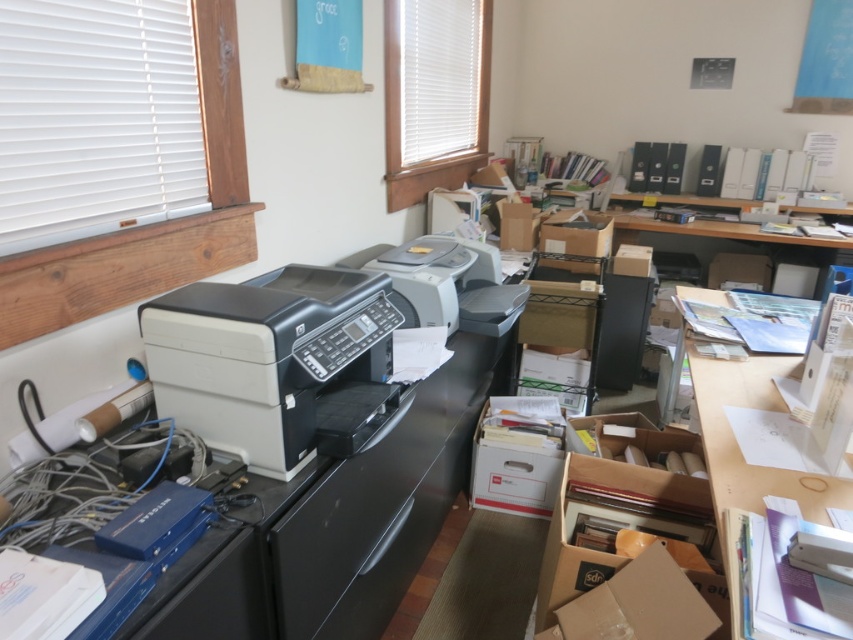
You are standing in the office and need to reach both the point at coordinates (252, 348) and the point at coordinates (701, 515). Which point will you reach first?

You will reach the point at coordinates (252, 348) first because it is closer to you than the point at coordinates (701, 515).

You are organizing the office and need to move the cardboard at center and the white matte printer at center. Which object is closer to you when you are facing the office layout?

The cardboard at center is closer to you because it is in front of the white matte printer at center.